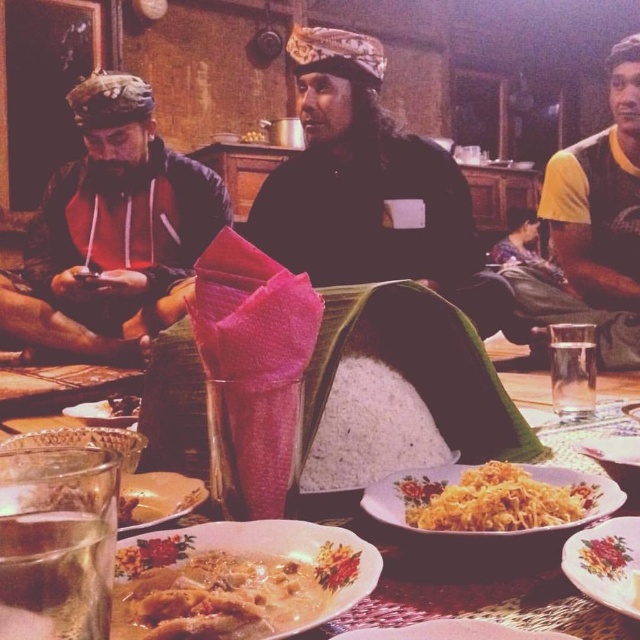
Question: Is the position of white rice at center more distant than that of smooth white rice at center?

Choices:
 (A) no
 (B) yes

Answer: (A)

Question: From the image, what is the correct spatial relationship of thick creamy soup at center in relation to yellow fabric shirt at right?

Choices:
 (A) left
 (B) right

Answer: (A)

Question: Which point is farther to the camera?

Choices:
 (A) (138, 397)
 (B) (413, 484)
 (C) (580, 356)

Answer: (A)

Question: Which object is closer to the camera taking this photo?

Choices:
 (A) matte black shirt at center
 (B) yellow rice at center
 (C) clear glass at right
 (D) smooth white rice at center

Answer: (B)

Question: Among these points, which one is farthest from the camera?

Choices:
 (A) (548, 204)
 (B) (573, 506)
 (C) (118, 625)

Answer: (A)

Question: Does thick creamy soup at center come behind translucent glass at lower left?

Choices:
 (A) no
 (B) yes

Answer: (B)